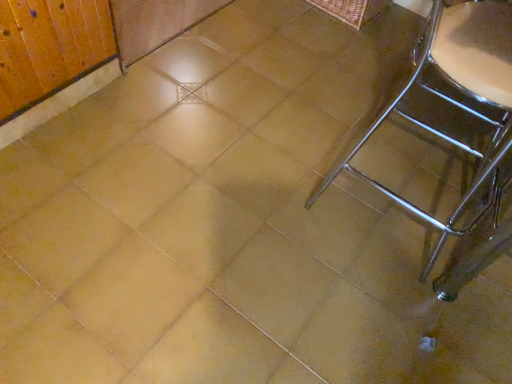
Question: Does point (493, 119) appear closer or farther from the camera than point (354, 6)?

Choices:
 (A) closer
 (B) farther

Answer: (A)

Question: From the image's perspective, is polished chrome chair at right above or below woven brown basket at upper right?

Choices:
 (A) above
 (B) below

Answer: (B)

Question: In the image, is polished chrome chair at right on the left side or the right side of woven brown basket at upper right?

Choices:
 (A) right
 (B) left

Answer: (A)

Question: From a real-world perspective, is woven brown basket at upper right physically located above or below polished chrome chair at right?

Choices:
 (A) above
 (B) below

Answer: (B)

Question: Considering the positions of woven brown basket at upper right and polished chrome chair at right in the image, is woven brown basket at upper right taller or shorter than polished chrome chair at right?

Choices:
 (A) short
 (B) tall

Answer: (A)

Question: From the image's perspective, is woven brown basket at upper right positioned above or below polished chrome chair at right?

Choices:
 (A) above
 (B) below

Answer: (A)

Question: Is woven brown basket at upper right wider or thinner than polished chrome chair at right?

Choices:
 (A) wide
 (B) thin

Answer: (B)